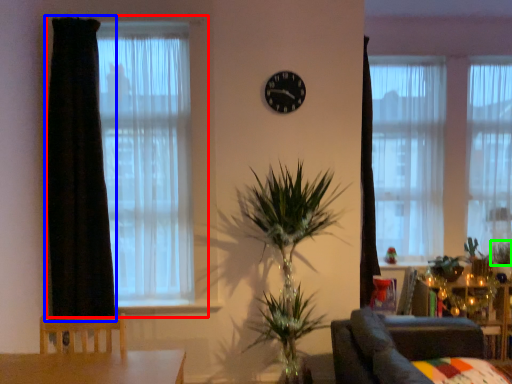
Question: Considering the real-world distances, which object is closest to window (highlighted by a red box)? curtain (highlighted by a blue box) or plant (highlighted by a green box).

Choices:
 (A) curtain
 (B) plant

Answer: (A)